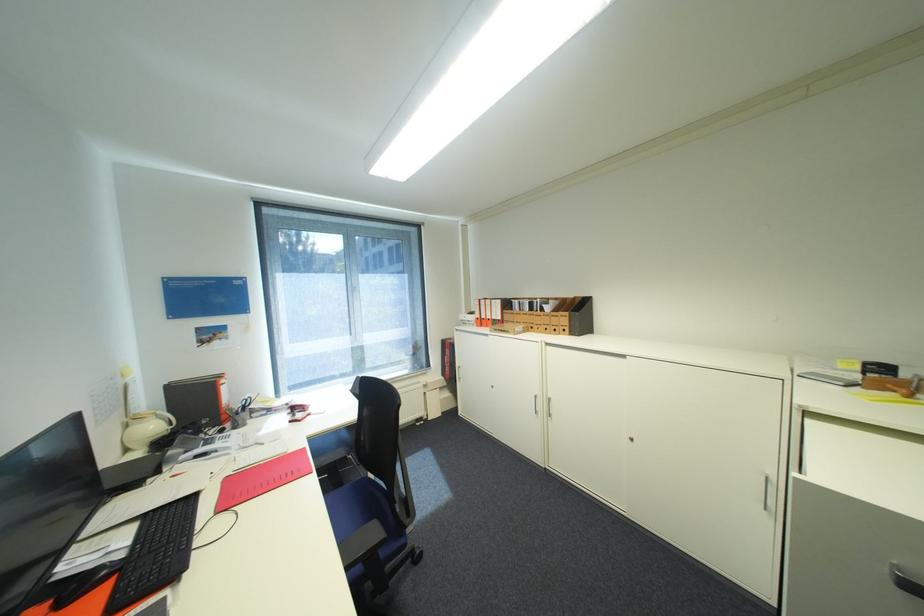
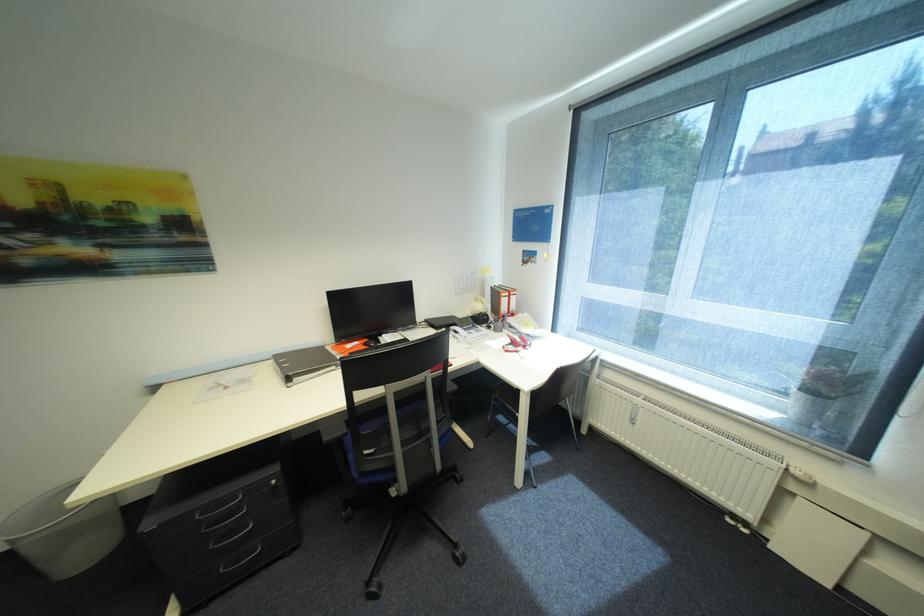
The point at (224,342) is marked in the first image. Where is the corresponding point in the second image?

(537, 265)